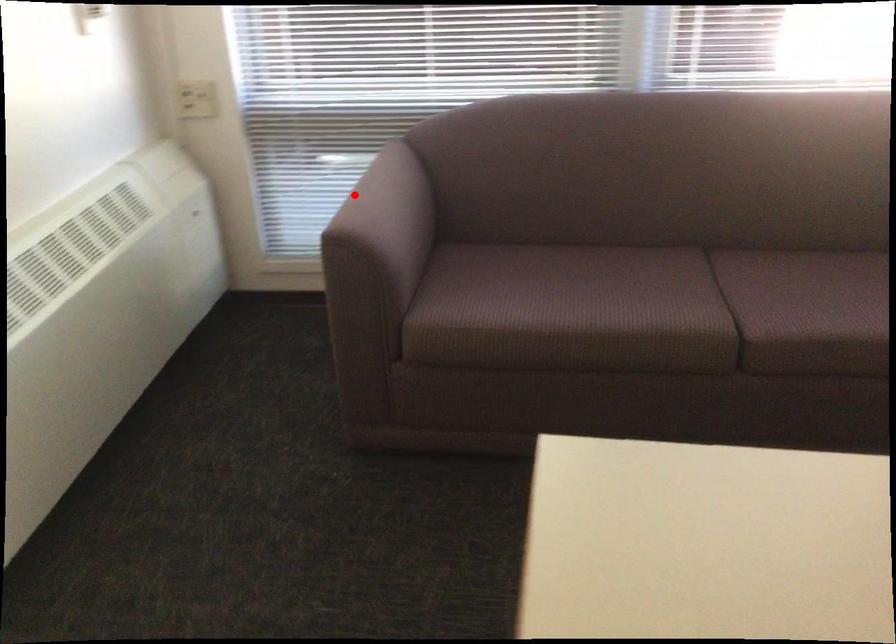
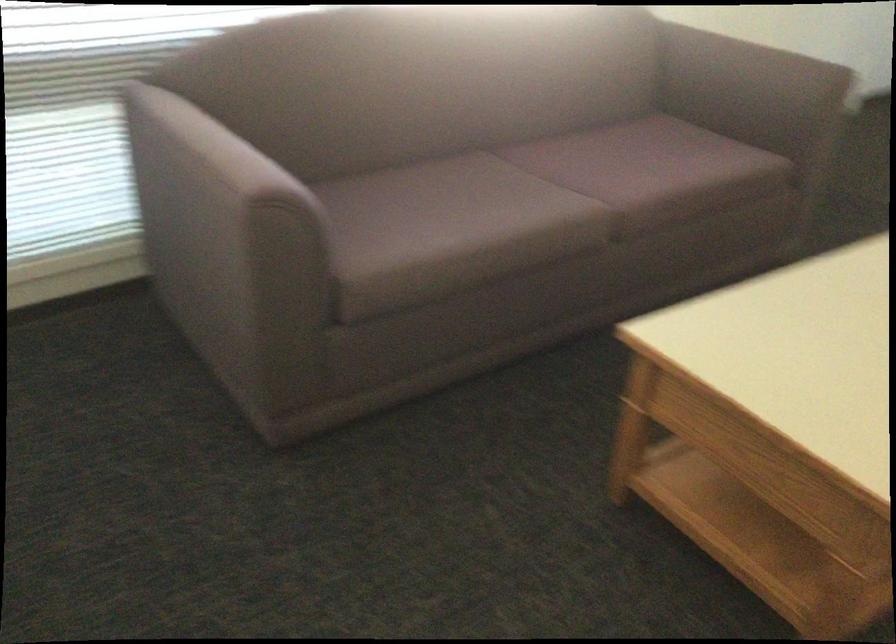
Locate, in the second image, the point that corresponds to the highlighted location in the first image.

(216, 147)